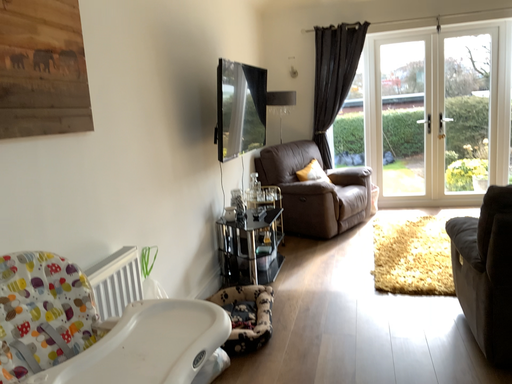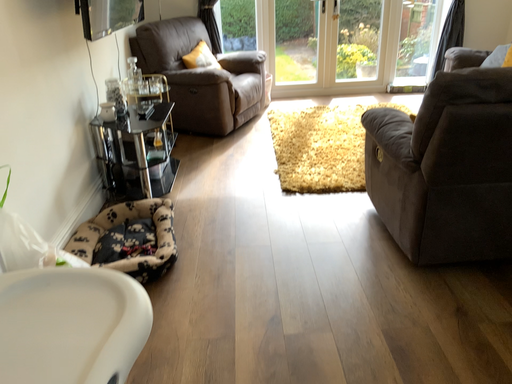
Question: How did the camera likely rotate when shooting the video?

Choices:
 (A) rotated left
 (B) rotated right

Answer: (B)